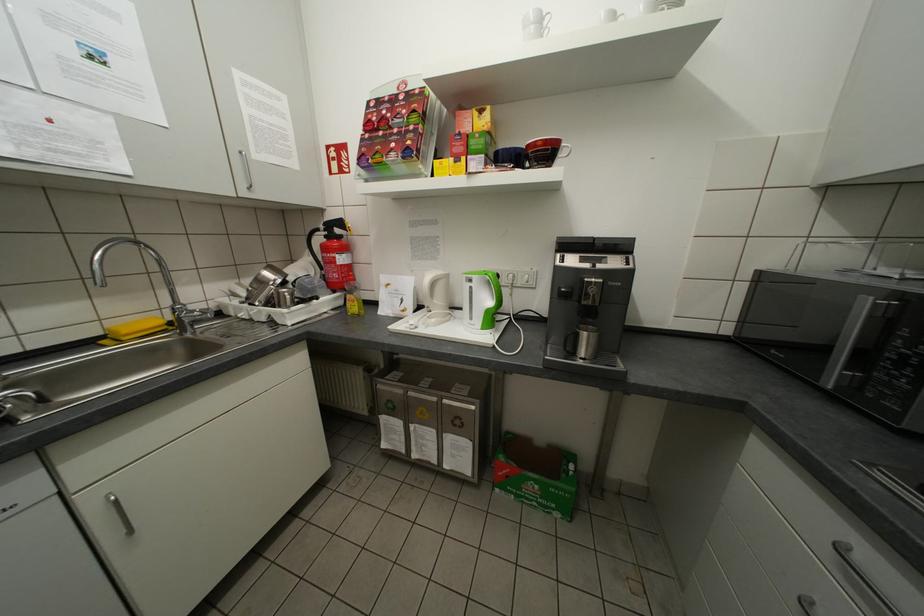
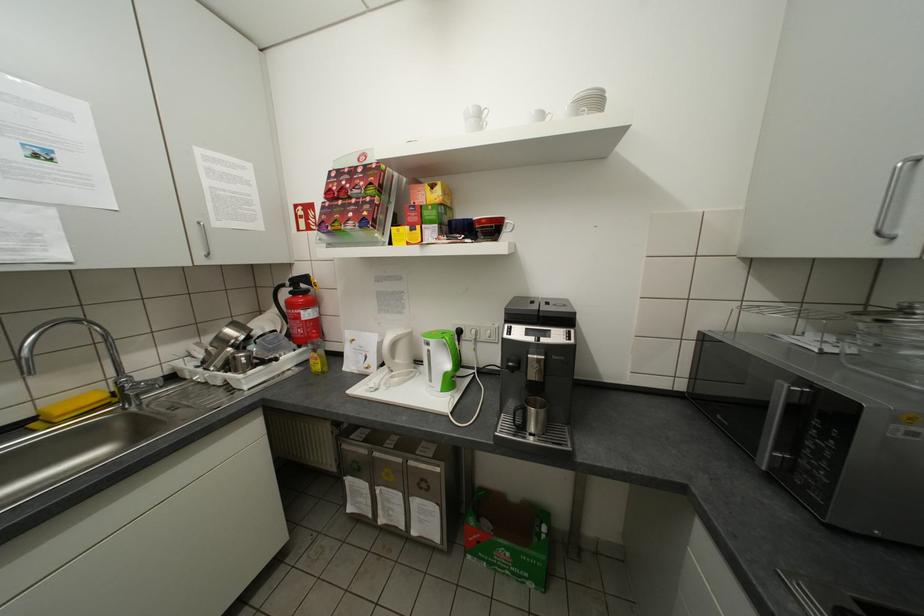
Locate, in the second image, the point that corresponds to pixel 877 302 in the first image.

(793, 389)